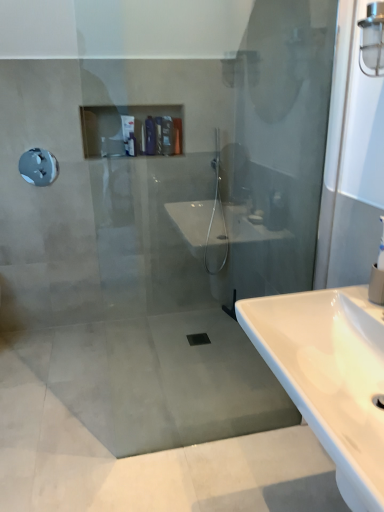
Question: Does white glossy sink at lower right touch matte plastic toiletries at upper center, the 1th toiletry when ordered from right to left?

Choices:
 (A) yes
 (B) no

Answer: (B)

Question: Is white glossy sink at lower right positioned behind matte plastic toiletries at upper center, the 1th toiletry when ordered from right to left?

Choices:
 (A) no
 (B) yes

Answer: (A)

Question: From a real-world perspective, is white glossy sink at lower right on top of matte plastic toiletries at upper center, the third toiletry when ordered from left to right?

Choices:
 (A) yes
 (B) no

Answer: (B)

Question: Is white glossy sink at lower right to the right of matte plastic toiletries at upper center, the third toiletry when ordered from left to right, from the viewer's perspective?

Choices:
 (A) yes
 (B) no

Answer: (A)

Question: Does white glossy sink at lower right have a smaller size compared to matte plastic toiletries at upper center, the 1th toiletry when ordered from right to left?

Choices:
 (A) yes
 (B) no

Answer: (B)

Question: Considering the positions of matte plastic toiletries at upper center, the 1th toiletry when ordered from right to left, and clear glass light fixture at upper right in the image, is matte plastic toiletries at upper center, the 1th toiletry when ordered from right to left, taller or shorter than clear glass light fixture at upper right?

Choices:
 (A) short
 (B) tall

Answer: (A)

Question: From the image's perspective, relative to clear glass light fixture at upper right, is matte plastic toiletries at upper center, the 1th toiletry when ordered from right to left, above or below?

Choices:
 (A) above
 (B) below

Answer: (A)

Question: In the image, is matte plastic toiletries at upper center, the 1th toiletry when ordered from right to left, on the left side or the right side of clear glass light fixture at upper right?

Choices:
 (A) left
 (B) right

Answer: (A)

Question: From a real-world perspective, relative to clear glass light fixture at upper right, is matte plastic toiletries at upper center, the third toiletry when ordered from left to right, vertically above or below?

Choices:
 (A) above
 (B) below

Answer: (B)

Question: Is metallic gray showerhead at upper left inside or outside of matte plastic toiletries at upper center, the 1th toiletry when ordered from right to left?

Choices:
 (A) outside
 (B) inside

Answer: (A)

Question: From the image's perspective, is metallic gray showerhead at upper left located above or below matte plastic toiletries at upper center, the 1th toiletry when ordered from right to left?

Choices:
 (A) below
 (B) above

Answer: (A)

Question: Considering the positions of metallic gray showerhead at upper left and matte plastic toiletries at upper center, the 1th toiletry when ordered from right to left, in the image, is metallic gray showerhead at upper left taller or shorter than matte plastic toiletries at upper center, the 1th toiletry when ordered from right to left,?

Choices:
 (A) short
 (B) tall

Answer: (B)

Question: Looking at the image, does metallic gray showerhead at upper left seem bigger or smaller compared to matte plastic toiletries at upper center, the 1th toiletry when ordered from right to left?

Choices:
 (A) big
 (B) small

Answer: (B)

Question: From a real-world perspective, is metallic gray showerhead at upper left positioned above or below clear glass light fixture at upper right?

Choices:
 (A) below
 (B) above

Answer: (A)

Question: Does point (21, 159) appear closer or farther from the camera than point (379, 67)?

Choices:
 (A) closer
 (B) farther

Answer: (B)